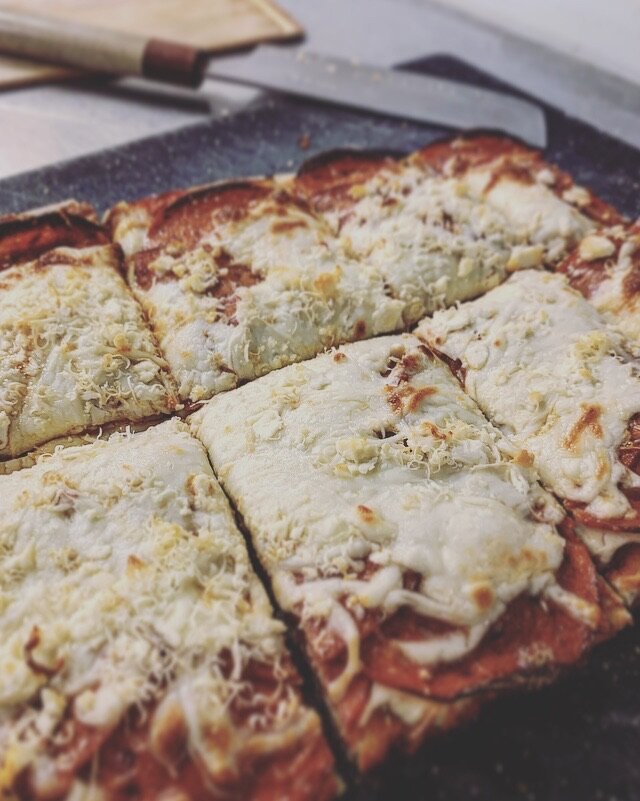
The height and width of the screenshot is (801, 640). I want to click on black pan, so click(x=244, y=139), click(x=584, y=734).